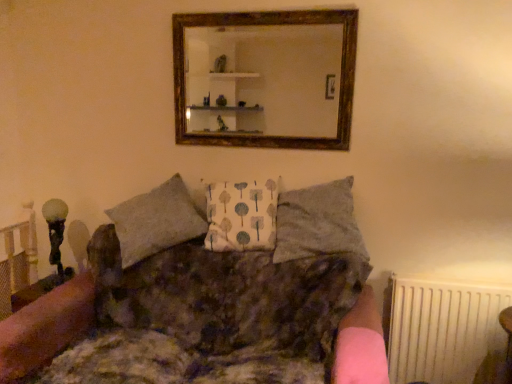
Where is `vacant area on top of wooden frame mirror at upper center (from a real-world perspective)`? This screenshot has width=512, height=384. vacant area on top of wooden frame mirror at upper center (from a real-world perspective) is located at coordinates (260, 7).